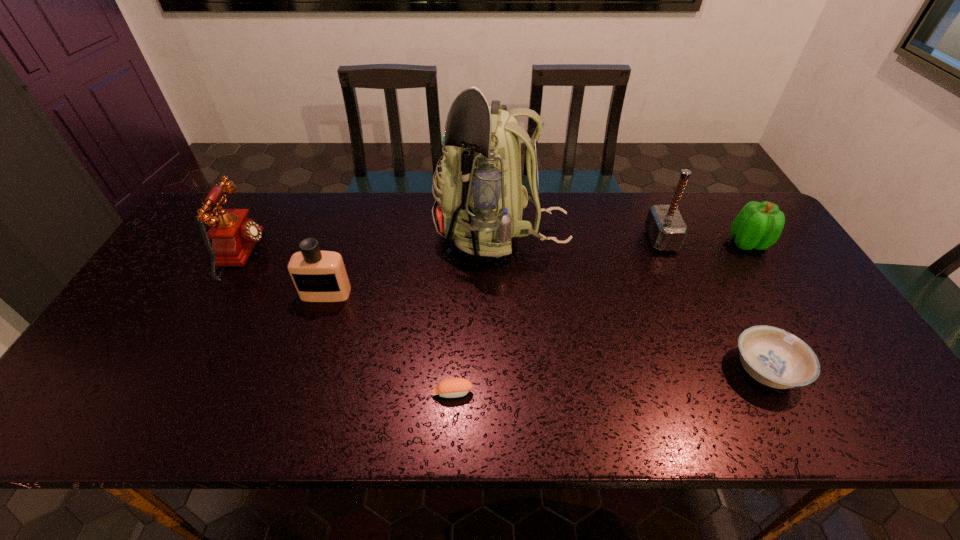
This screenshot has height=540, width=960. What are the coordinates of `the tallest object` in the screenshot? It's located at (479, 201).

Find the location of `the second tallest object`. the second tallest object is located at coordinates (665, 226).

Locate an element on the screen. The image size is (960, 540). the leftmost object is located at coordinates (233, 235).

Locate an element on the screen. The image size is (960, 540). the sixth object from right to left is located at coordinates (319, 276).

Where is `the fifth farthest object`? Image resolution: width=960 pixels, height=540 pixels. the fifth farthest object is located at coordinates (319, 276).

Find the location of `the rightmost object`. the rightmost object is located at coordinates 758,225.

The image size is (960, 540). Identify the location of the fifth tallest object. (758, 225).

The image size is (960, 540). Find the location of `the sixth tallest object`. the sixth tallest object is located at coordinates (774, 357).

At what (x,y) coordinates should I click in order to perform the action: click on the shortest object. Please return your answer as a coordinate pair (x, y). The height and width of the screenshot is (540, 960). Looking at the image, I should click on (451, 387).

Where is `free spot located 0.150m on the front-facing side of the tallest object`? The image size is (960, 540). free spot located 0.150m on the front-facing side of the tallest object is located at coordinates (386, 236).